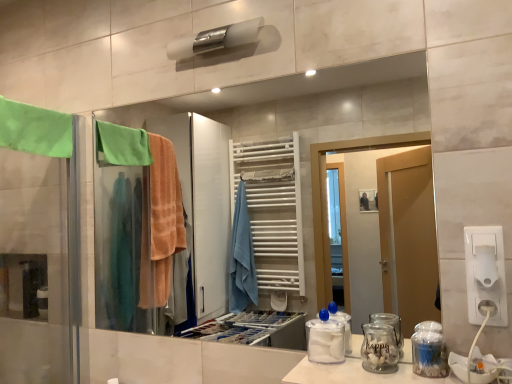
I want to click on space that is in front of clear glass jar at lower right, which is the 2th glass jar in right-to-left order, so click(x=394, y=377).